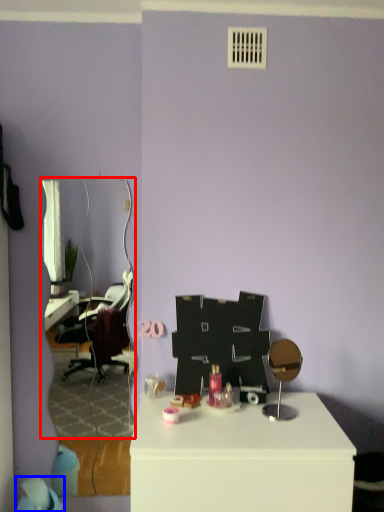
Question: Which of the following is the closest to the observer, mirror (highlighted by a red box) or bean bag chair (highlighted by a blue box)?

Choices:
 (A) mirror
 (B) bean bag chair

Answer: (B)